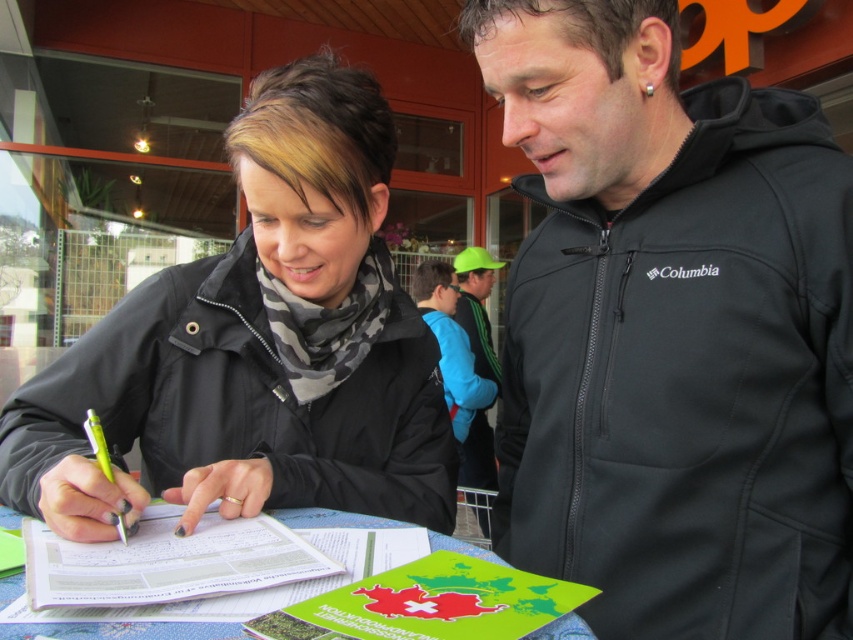
Between translucent yellow pen at lower left and black softshell jacket at upper center, which one appears on the right side from the viewer's perspective?

From the viewer's perspective, black softshell jacket at upper center appears more on the right side.

Can you confirm if translucent yellow pen at lower left is taller than black softshell jacket at upper center?

Yes.

Which is behind, point (123, 524) or point (685, 275)?

The point (685, 275) is behind.

Identify the location of translucent yellow pen at lower left. (97, 444).

Who is shorter, black softshell jacket at center or white paper at center?

white paper at center is shorter.

Measure the distance between black softshell jacket at center and camera.

black softshell jacket at center and camera are 28.95 inches apart from each other.

Where is `black softshell jacket at center`? This screenshot has width=853, height=640. black softshell jacket at center is located at coordinates (671, 332).

Between black softshell jacket at center and black softshell jacket at upper center, which one has less height?

With less height is black softshell jacket at upper center.

Who is higher up, black softshell jacket at center or black softshell jacket at upper center?

Positioned higher is black softshell jacket at upper center.

Who is more forward, (648, 524) or (688, 272)?

Positioned in front is point (648, 524).

Find the location of a particular element. This screenshot has width=853, height=640. black softshell jacket at center is located at coordinates (671, 332).